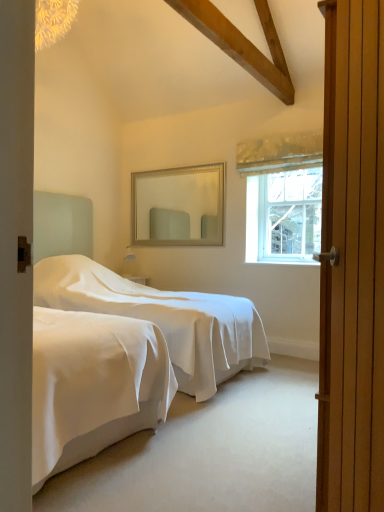
Identify the location of white smooth bed at center. The image size is (384, 512). (144, 301).

This screenshot has width=384, height=512. What are the coordinates of `wooden door at right` in the screenshot? It's located at (352, 261).

This screenshot has height=512, width=384. Identify the location of white smooth bed at center. (144, 301).

Between wooden door at right and white smooth bed at center, which one has larger size?

With larger size is white smooth bed at center.

How different are the orientations of wooden door at right and white smooth bed at center in degrees?

The angle between the facing direction of wooden door at right and the facing direction of white smooth bed at center is 152 degrees.

Visually, is wooden door at right positioned to the left or to the right of white smooth bed at center?

In the image, wooden door at right appears on the right side of white smooth bed at center.

Is white smooth bed at center a part of wooden door at right?

Actually, white smooth bed at center is outside wooden door at right.

Considering the relative positions of clear glass window at upper right and silver/golden frame mirror at upper center in the image provided, is clear glass window at upper right to the left of silver/golden frame mirror at upper center from the viewer's perspective?

In fact, clear glass window at upper right is to the right of silver/golden frame mirror at upper center.

Which of these two, clear glass window at upper right or silver/golden frame mirror at upper center, stands taller?

clear glass window at upper right is taller.

Could you measure the distance between clear glass window at upper right and silver/golden frame mirror at upper center?

A distance of 30.30 inches exists between clear glass window at upper right and silver/golden frame mirror at upper center.

Based on the photo, from the image's perspective, is clear glass window at upper right positioned above or below silver/golden frame mirror at upper center?

Based on their image positions, clear glass window at upper right is located beneath silver/golden frame mirror at upper center.

In the scene shown: From a real-world perspective, relative to white smooth bed at center, is clear glass window at upper right vertically above or below?

Clearly, from a real-world perspective, clear glass window at upper right is above white smooth bed at center.

Can you confirm if clear glass window at upper right is positioned to the left of white smooth bed at center?

No, clear glass window at upper right is not to the left of white smooth bed at center.

Is clear glass window at upper right bigger than white smooth bed at center?

Actually, clear glass window at upper right might be smaller than white smooth bed at center.

Does point (256, 225) come behind point (244, 314)?

That is True.

Considering the relative positions of clear glass window at upper right and wooden door at right in the image provided, is clear glass window at upper right to the right of wooden door at right from the viewer's perspective?

Indeed, clear glass window at upper right is positioned on the right side of wooden door at right.

Considering the relative sizes of clear glass window at upper right and wooden door at right in the image provided, is clear glass window at upper right bigger than wooden door at right?

Incorrect, clear glass window at upper right is not larger than wooden door at right.

Who is more distant, silver/golden frame mirror at upper center or clear glass window at upper right?

silver/golden frame mirror at upper center is further away from the camera.

Which of these two, silver/golden frame mirror at upper center or clear glass window at upper right, is bigger?

silver/golden frame mirror at upper center is bigger.

Is silver/golden frame mirror at upper center thinner than clear glass window at upper right?

Incorrect, the width of silver/golden frame mirror at upper center is not less than that of clear glass window at upper right.

From a real-world perspective, is silver/golden frame mirror at upper center beneath clear glass window at upper right?

No, from a real-world perspective, silver/golden frame mirror at upper center is not below clear glass window at upper right.

From the picture: Which is more to the left, white smooth bed at center or clear glass window at upper right?

Positioned to the left is white smooth bed at center.

Is white smooth bed at center not within clear glass window at upper right?

Yes, white smooth bed at center is not within clear glass window at upper right.

Is white smooth bed at center positioned far away from clear glass window at upper right?

white smooth bed at center is far away from clear glass window at upper right.

Locate an element on the screen. The width and height of the screenshot is (384, 512). bed that is below the clear glass window at upper right (from the image's perspective) is located at coordinates (144, 301).

Is white smooth bed at center spatially inside wooden door at right, or outside of it?

white smooth bed at center is outside wooden door at right.

Is white smooth bed at center taller than wooden door at right?

Yes.

How many degrees apart are the facing directions of white smooth bed at center and wooden door at right?

white smooth bed at center and wooden door at right are facing 152 degrees away from each other.

From a real-world perspective, is white smooth bed at center located beneath wooden door at right?

Indeed, from a real-world perspective, white smooth bed at center is positioned beneath wooden door at right.

At what (x,y) coordinates should I click in order to perform the action: click on door in front of the white smooth bed at center. Please return your answer as a coordinate pair (x, y). Looking at the image, I should click on (352, 261).

This screenshot has width=384, height=512. I want to click on mirror that is behind the clear glass window at upper right, so click(x=178, y=206).

From the image, which object appears to be farther from white smooth bed at center, clear glass window at upper right or silver/golden frame mirror at upper center?

clear glass window at upper right is further to white smooth bed at center.

Based on their spatial positions, is white smooth bed at center or silver/golden frame mirror at upper center further from wooden door at right?

Among the two, silver/golden frame mirror at upper center is located further to wooden door at right.

When comparing their distances from white smooth bed at center, does silver/golden frame mirror at upper center or wooden door at right seem further?

The object further to white smooth bed at center is wooden door at right.

Which object lies further to the anchor point wooden door at right, clear glass window at upper right or silver/golden frame mirror at upper center?

silver/golden frame mirror at upper center is further to wooden door at right.

From the image, which object appears to be nearer to silver/golden frame mirror at upper center, wooden door at right or clear glass window at upper right?

The object closer to silver/golden frame mirror at upper center is clear glass window at upper right.

Estimate the real-world distances between objects in this image. Which object is closer to wooden door at right, silver/golden frame mirror at upper center or clear glass window at upper right?

clear glass window at upper right is closer to wooden door at right.

From the image, which object appears to be farther from wooden door at right, clear glass window at upper right or white smooth bed at center?

Based on the image, clear glass window at upper right appears to be further to wooden door at right.

Based on their spatial positions, is silver/golden frame mirror at upper center or white smooth bed at center closer to clear glass window at upper right?

silver/golden frame mirror at upper center lies closer to clear glass window at upper right than the other object.

Locate an element on the screen. This screenshot has width=384, height=512. bed positioned between wooden door at right and clear glass window at upper right from near to far is located at coordinates (144, 301).

Locate an element on the screen. The image size is (384, 512). window located between wooden door at right and silver/golden frame mirror at upper center in the depth direction is located at coordinates (282, 196).

You are a GUI agent. You are given a task and a screenshot of the screen. Output one action in this format:
    pyautogui.click(x=<x>, y=<y>)
    Task: Click on the window between white smooth bed at center and silver/golden frame mirror at upper center in the front-back direction
    Image resolution: width=384 pixels, height=512 pixels.
    Given the screenshot: What is the action you would take?
    pyautogui.click(x=282, y=196)

This screenshot has height=512, width=384. Identify the location of bed between wooden door at right and silver/golden frame mirror at upper center in the front-back direction. (144, 301).